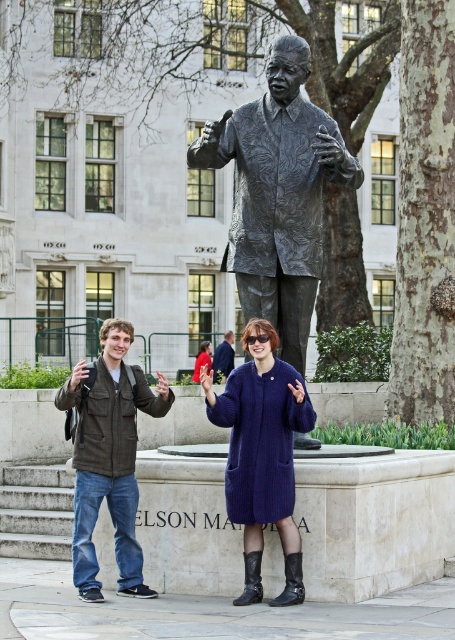
Which is in front, point (292, 595) or point (228, 352)?

Point (292, 595)

Does navy wool coat at center lie behind matte black jacket at center?

No, navy wool coat at center is in front of matte black jacket at center.

At what (x,y) coordinates should I click in order to perform the action: click on navy wool coat at center. Please return your answer as a coordinate pair (x, y). This screenshot has height=640, width=455. Looking at the image, I should click on (262, 454).

Find the location of a particular element. This screenshot has width=455, height=640. navy wool coat at center is located at coordinates (262, 454).

Is point (281, 435) behind point (96, 371)?

No, it is not.

What do you see at coordinates (262, 454) in the screenshot? This screenshot has width=455, height=640. I see `navy wool coat at center` at bounding box center [262, 454].

You are a GUI agent. You are given a task and a screenshot of the screen. Output one action in this format:
    pyautogui.click(x=<x>, y=<y>)
    Task: Click on the navy wool coat at center
    
    Given the screenshot: What is the action you would take?
    pyautogui.click(x=262, y=454)

Where is `blue wool coat at center`? The width and height of the screenshot is (455, 640). blue wool coat at center is located at coordinates (262, 452).

Does blue wool coat at center lie behind matte blue coat at center?

That is False.

From the picture: Who is more forward, (111, 397) or (208, 340)?

Point (111, 397) is more forward.

Image resolution: width=455 pixels, height=640 pixels. Identify the location of blue wool coat at center. (262, 452).